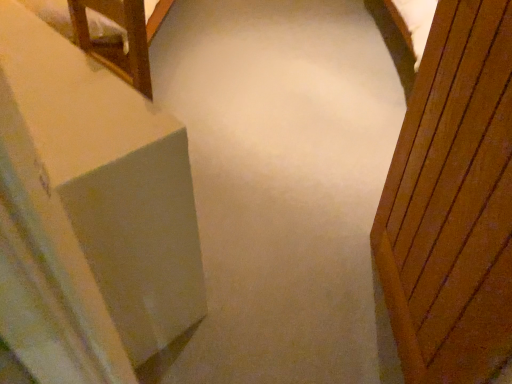
This screenshot has width=512, height=384. Describe the element at coordinates (452, 202) in the screenshot. I see `wooden door at right` at that location.

The image size is (512, 384). Identify the location of wooden door at right. (452, 202).

What is the approximate height of wooden door at right?

wooden door at right is 1.04 meters in height.

This screenshot has width=512, height=384. I want to click on wooden door at right, so click(452, 202).